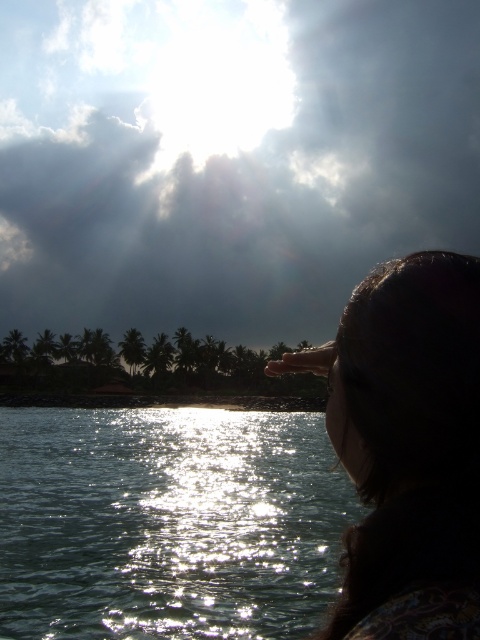
Who is positioned more to the left, cloudy sky at upper center or sparkling silver water at lower left?

cloudy sky at upper center is more to the left.

Find the location of a particular element. This screenshot has width=480, height=640. cloudy sky at upper center is located at coordinates (228, 157).

This screenshot has width=480, height=640. Find the location of `cloudy sky at upper center`. cloudy sky at upper center is located at coordinates (228, 157).

Can you confirm if sparkling silver water at lower left is taller than silhouette hair at upper right?

Indeed, sparkling silver water at lower left has a greater height compared to silhouette hair at upper right.

Describe the element at coordinates (168, 524) in the screenshot. The image size is (480, 640). I see `sparkling silver water at lower left` at that location.

The width and height of the screenshot is (480, 640). What do you see at coordinates (168, 524) in the screenshot?
I see `sparkling silver water at lower left` at bounding box center [168, 524].

Where is `sparkling silver water at lower left`? The image size is (480, 640). sparkling silver water at lower left is located at coordinates (168, 524).

The height and width of the screenshot is (640, 480). What are the coordinates of `cloudy sky at upper center` in the screenshot? It's located at pos(228,157).

What do you see at coordinates (228, 157) in the screenshot? I see `cloudy sky at upper center` at bounding box center [228, 157].

Find the location of a particular element. cloudy sky at upper center is located at coordinates (228, 157).